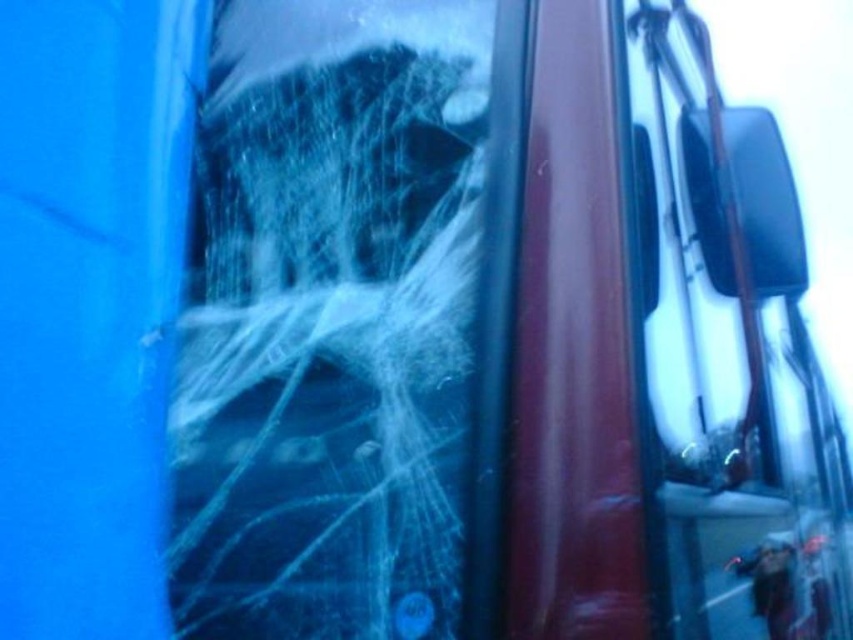
Question: Does white fibrous spider web at center have a greater width compared to transparent glass windshield at right?

Choices:
 (A) no
 (B) yes

Answer: (A)

Question: Does white fibrous spider web at center appear on the right side of transparent glass windshield at right?

Choices:
 (A) yes
 (B) no

Answer: (B)

Question: Which object appears farthest from the camera in this image?

Choices:
 (A) white fibrous spider web at center
 (B) transparent glass windshield at right

Answer: (A)

Question: Does white fibrous spider web at center appear over transparent glass windshield at right?

Choices:
 (A) no
 (B) yes

Answer: (B)